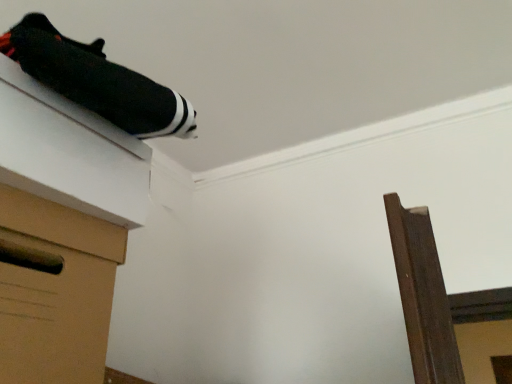
Question: Is black fabric shoe at upper left facing away from black fabric at upper left?

Choices:
 (A) yes
 (B) no

Answer: (B)

Question: Is black fabric shoe at upper left with black fabric at upper left?

Choices:
 (A) no
 (B) yes

Answer: (A)

Question: Can you confirm if black fabric shoe at upper left is smaller than black fabric at upper left?

Choices:
 (A) no
 (B) yes

Answer: (B)

Question: From the image's perspective, is black fabric shoe at upper left on black fabric at upper left?

Choices:
 (A) yes
 (B) no

Answer: (A)

Question: Is black fabric shoe at upper left to the left of black fabric at upper left from the viewer's perspective?

Choices:
 (A) yes
 (B) no

Answer: (B)

Question: Is black fabric shoe at upper left taller than black fabric at upper left?

Choices:
 (A) yes
 (B) no

Answer: (B)

Question: Is brown cardboard drawer at lower left bigger than black fabric shoe at upper left?

Choices:
 (A) yes
 (B) no

Answer: (A)

Question: From the image's perspective, is brown cardboard drawer at lower left under black fabric shoe at upper left?

Choices:
 (A) yes
 (B) no

Answer: (A)

Question: Does brown cardboard drawer at lower left have a greater width compared to black fabric shoe at upper left?

Choices:
 (A) yes
 (B) no

Answer: (A)

Question: Does brown cardboard drawer at lower left have a lesser width compared to black fabric shoe at upper left?

Choices:
 (A) yes
 (B) no

Answer: (B)

Question: Is brown cardboard drawer at lower left behind black fabric shoe at upper left?

Choices:
 (A) no
 (B) yes

Answer: (A)

Question: Would you say brown cardboard drawer at lower left is outside black fabric shoe at upper left?

Choices:
 (A) yes
 (B) no

Answer: (A)

Question: Is brown cardboard drawer at lower left touching black fabric at upper left?

Choices:
 (A) no
 (B) yes

Answer: (B)